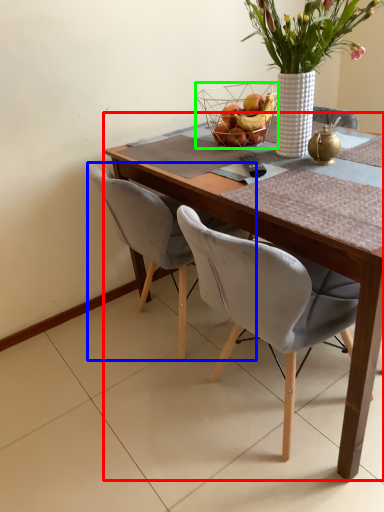
Question: Considering the real-world distances, which object is farthest from round table (highlighted by a red box)? chair (highlighted by a blue box) or basket (highlighted by a green box)?

Choices:
 (A) chair
 (B) basket

Answer: (B)